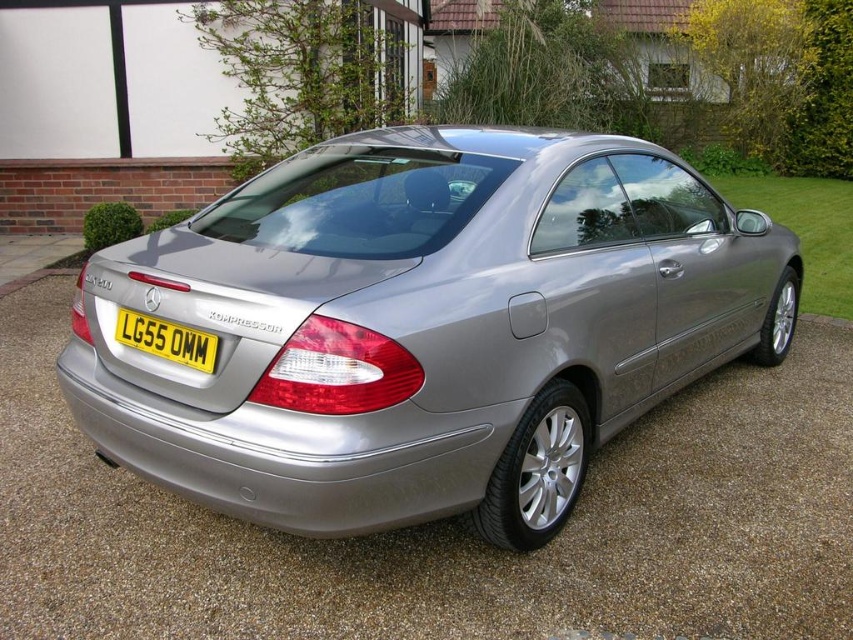
Does satin silver car at center appear on the left side of yellow metallic license plate at rear?

In fact, satin silver car at center is to the right of yellow metallic license plate at rear.

Is satin silver car at center below yellow metallic license plate at rear?

Incorrect, satin silver car at center is not positioned below yellow metallic license plate at rear.

Does point (206, 426) come in front of point (119, 328)?

That is True.

The height and width of the screenshot is (640, 853). Find the location of `satin silver car at center`. satin silver car at center is located at coordinates (422, 324).